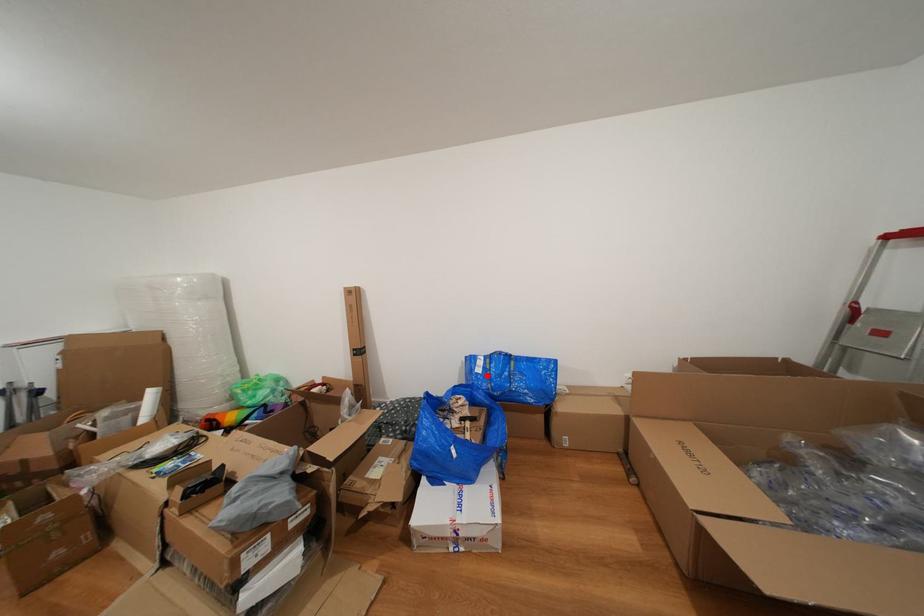
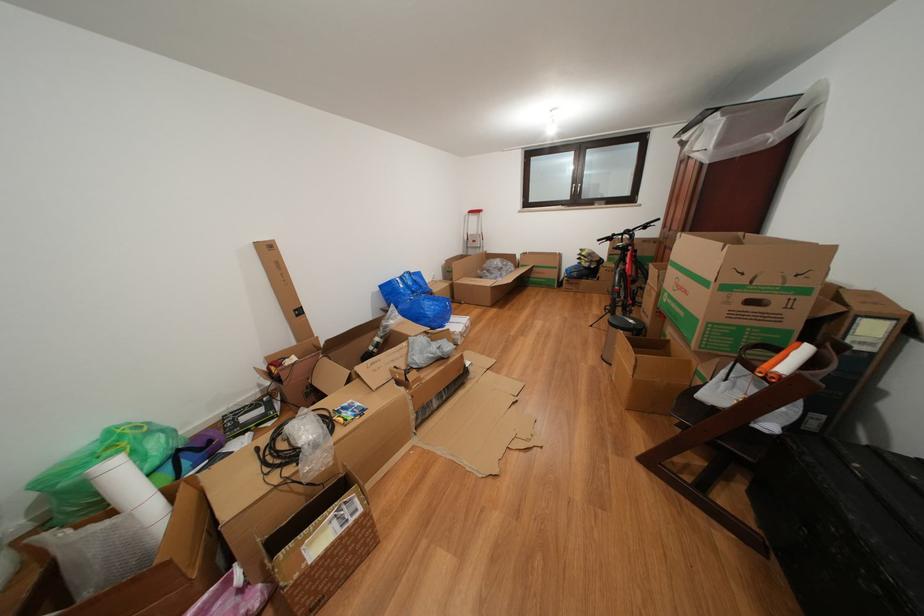
Question: I am providing you with two images of the same scene from different viewpoints. Image1 has a red point marked. In image2, the corresponding 3D location appears at what relative position? Reply with the corresponding letter.

Choices:
 (A) Closer
 (B) Farther

Answer: (A)